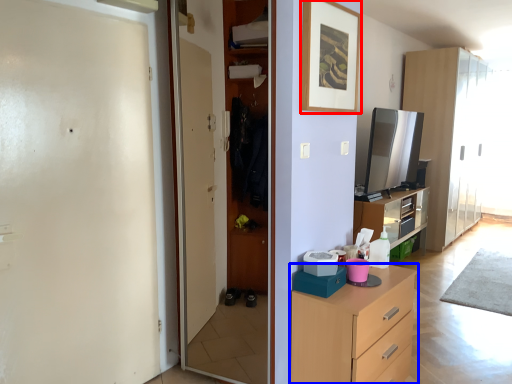
Question: Which object appears closest to the camera in this image, picture frame (highlighted by a red box) or chest of drawers (highlighted by a blue box)?

Choices:
 (A) picture frame
 (B) chest of drawers

Answer: (B)